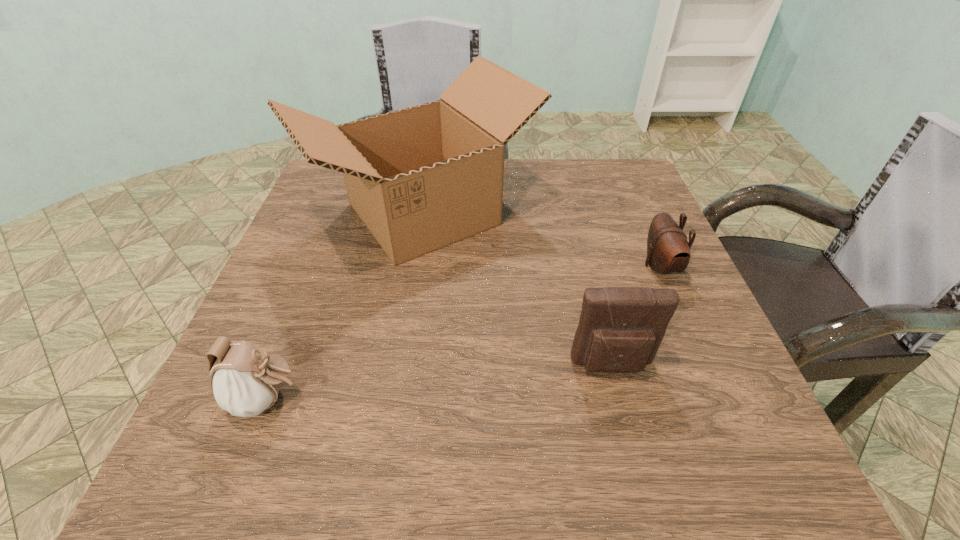
What are the coordinates of `vacant space at the far left corner` in the screenshot? It's located at (341, 204).

Locate an element on the screen. The image size is (960, 540). vacant region at the far right corner is located at coordinates (588, 171).

At what (x,y) coordinates should I click in order to perform the action: click on free spot at the near right corner of the desktop. Please return your answer as a coordinate pair (x, y). The width and height of the screenshot is (960, 540). Looking at the image, I should click on (702, 433).

Identify the location of empty location between the farthest pouch and the box. This screenshot has height=540, width=960. (541, 240).

Identify the location of vacant space in between the second shortest object and the farthest pouch. The image size is (960, 540). (464, 333).

Find the location of a particular element. The height and width of the screenshot is (540, 960). vacant space in between the tallest object and the leftmost pouch is located at coordinates (346, 307).

At what (x,y) coordinates should I click in order to perform the action: click on free spot between the third tallest object and the box. Please return your answer as a coordinate pair (x, y). Looking at the image, I should click on (346, 307).

You are a GUI agent. You are given a task and a screenshot of the screen. Output one action in this format:
    pyautogui.click(x=<x>, y=<y>)
    Task: Click on the vacant area that lies between the tallest object and the second shortest object
    The image size is (960, 540).
    Given the screenshot: What is the action you would take?
    click(346, 307)

At what (x,y) coordinates should I click in order to perform the action: click on free space between the leftmost pouch and the second tallest object. Please return your answer as a coordinate pair (x, y). The height and width of the screenshot is (540, 960). Looking at the image, I should click on (441, 382).

Where is `free space between the shortest pouch and the box`? free space between the shortest pouch and the box is located at coordinates (541, 240).